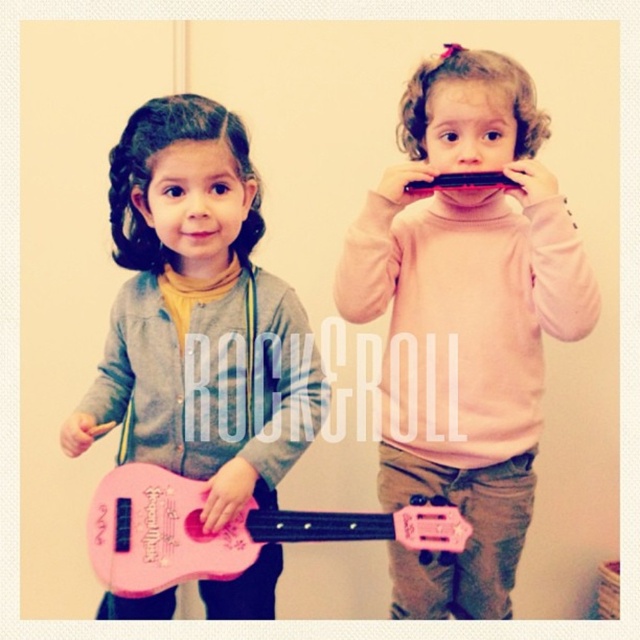
Question: Among these objects, which one is nearest to the camera?

Choices:
 (A) pink plastic guitar at center
 (B) pink matte guitar at center

Answer: (B)

Question: Based on their relative distances, which object is farther from the pink plastic guitar at left?

Choices:
 (A) pink plastic guitar at center
 (B) pink matte guitar at center

Answer: (A)

Question: Does pink plastic guitar at center appear on the left side of pink matte guitar at center?

Choices:
 (A) yes
 (B) no

Answer: (B)

Question: Does pink plastic guitar at left appear over pink matte guitar at center?

Choices:
 (A) no
 (B) yes

Answer: (B)

Question: Among these objects, which one is farthest from the camera?

Choices:
 (A) pink plastic guitar at left
 (B) pink matte guitar at center
 (C) pink plastic guitar at center

Answer: (C)

Question: Does pink plastic guitar at center appear under pink matte guitar at center?

Choices:
 (A) no
 (B) yes

Answer: (A)